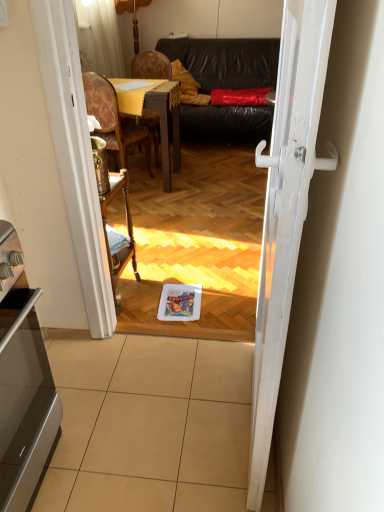
Where is `satin silver oven at lower left`? satin silver oven at lower left is located at coordinates (23, 384).

The height and width of the screenshot is (512, 384). What do you see at coordinates (23, 384) in the screenshot?
I see `satin silver oven at lower left` at bounding box center [23, 384].

This screenshot has height=512, width=384. Find the location of `woodenmaterial/texturetable at upper center`. woodenmaterial/texturetable at upper center is located at coordinates (160, 117).

Describe the element at coordinates (150, 425) in the screenshot. I see `beige tile at lower center` at that location.

Describe the element at coordinates (150, 66) in the screenshot. This screenshot has height=512, width=384. I see `wooden upholstered chair at center, arranged as the 1th chair when viewed from the back` at that location.

At what (x,y) coordinates should I click in order to perform the action: click on leather couch at center. Please return your answer as a coordinate pair (x, y). The image size is (384, 512). Looking at the image, I should click on (226, 61).

I want to click on woodenchair at center, marked as the 2th chair in a back-to-front arrangement, so click(x=113, y=120).

In order to click on satin silver oven at lower left in this screenshot , I will do `click(23, 384)`.

Based on the photo, considering the relative positions of leather couch at center and satin silver oven at lower left in the image provided, is leather couch at center in front of satin silver oven at lower left?

That is False.

This screenshot has width=384, height=512. In order to click on studio couch above the satin silver oven at lower left (from the image's perspective) in this screenshot , I will do `click(226, 61)`.

From a real-world perspective, is leather couch at center over satin silver oven at lower left?

Correct, in the physical world, leather couch at center is higher than satin silver oven at lower left.

This screenshot has width=384, height=512. In order to click on appliance below the woodenmaterial/texturetable at upper center (from a real-world perspective) in this screenshot , I will do `click(23, 384)`.

In the scene shown: How many degrees apart are the facing directions of woodenmaterial/texturetable at upper center and satin silver oven at lower left?

Answer: 91.9 degrees separate the facing orientations of woodenmaterial/texturetable at upper center and satin silver oven at lower left.

Does woodenmaterial/texturetable at upper center have a smaller size compared to satin silver oven at lower left?

Actually, woodenmaterial/texturetable at upper center might be larger than satin silver oven at lower left.

Would you say woodenmaterial/texturetable at upper center is to the left or to the right of satin silver oven at lower left in the picture?

Clearly, woodenmaterial/texturetable at upper center is on the right of satin silver oven at lower left in the image.

This screenshot has width=384, height=512. What are the coordinates of `studio couch on the right of woodenmaterial/texturetable at upper center` in the screenshot? It's located at (226, 61).

Between woodenmaterial/texturetable at upper center and leather couch at center, which one appears on the left side from the viewer's perspective?

From the viewer's perspective, woodenmaterial/texturetable at upper center appears more on the left side.

Consider the image. Which object is further away from the camera, woodenmaterial/texturetable at upper center or leather couch at center?

leather couch at center is more distant.

Who is shorter, woodenmaterial/texturetable at upper center or leather couch at center?

Standing shorter between the two is woodenmaterial/texturetable at upper center.

Which object is positioned more to the right, white glossy door at center or woodenmaterial/texturetable at upper center?

white glossy door at center is more to the right.

Which of these two, white glossy door at center or woodenmaterial/texturetable at upper center, is smaller?

white glossy door at center.

Is white glossy door at center far from woodenmaterial/texturetable at upper center?

Yes.

From a real-world perspective, which object rests below the other?

From a 3D spatial view, wooden upholstered chair at center, arranged as the 2th chair when viewed from the front, is below.

How much distance is there between wooden upholstered chair at center, arranged as the 1th chair when viewed from the back, and woodenchair at center, placed as the 1th chair when sorted from front to back?

The distance of wooden upholstered chair at center, arranged as the 1th chair when viewed from the back, from woodenchair at center, placed as the 1th chair when sorted from front to back, is 80.95 centimeters.

Considering the relative sizes of wooden upholstered chair at center, arranged as the 1th chair when viewed from the back, and woodenchair at center, marked as the 2th chair in a back-to-front arrangement, in the image provided, is wooden upholstered chair at center, arranged as the 1th chair when viewed from the back, smaller than woodenchair at center, marked as the 2th chair in a back-to-front arrangement,?

No, wooden upholstered chair at center, arranged as the 1th chair when viewed from the back, is not smaller than woodenchair at center, marked as the 2th chair in a back-to-front arrangement.

Is wooden upholstered chair at center, arranged as the 1th chair when viewed from the back, wider than woodenchair at center, placed as the 1th chair when sorted from front to back?

No.

Could you tell me if woodenchair at center, placed as the 1th chair when sorted from front to back, is facing leather couch at center?

Yes, woodenchair at center, placed as the 1th chair when sorted from front to back, is facing leather couch at center.

Are woodenchair at center, marked as the 2th chair in a back-to-front arrangement, and leather couch at center located far from each other?

woodenchair at center, marked as the 2th chair in a back-to-front arrangement, is far away from leather couch at center.

Is woodenchair at center, marked as the 2th chair in a back-to-front arrangement, to the right of leather couch at center from the viewer's perspective?

In fact, woodenchair at center, marked as the 2th chair in a back-to-front arrangement, is to the left of leather couch at center.

In the image, is woodenchair at center, placed as the 1th chair when sorted from front to back, positioned in front of or behind leather couch at center?

woodenchair at center, placed as the 1th chair when sorted from front to back, is positioned closer to the viewer than leather couch at center.

Considering the positions of points (137, 67) and (301, 135), is point (137, 67) farther from camera compared to point (301, 135)?

That is True.

From a real-world perspective, which object stands above the other?

From a 3D spatial view, white glossy door at center is above.

Would you say wooden upholstered chair at center, arranged as the 2th chair when viewed from the front, is outside white glossy door at center?

→ Yes.

At what (x,y) coordinates should I click in order to perform the action: click on appliance that appears below the leather couch at center (from the image's perspective). Please return your answer as a coordinate pair (x, y). This screenshot has height=512, width=384. Looking at the image, I should click on (23, 384).

Where is `table above the satin silver oven at lower left (from the image's perspective)`? table above the satin silver oven at lower left (from the image's perspective) is located at coordinates (160, 117).

Based on their spatial positions, is woodenmaterial/texturetable at upper center or wooden upholstered chair at center, arranged as the 1th chair when viewed from the back, further from leather couch at center?

woodenmaterial/texturetable at upper center.

Looking at the image, which one is located further to leather couch at center, satin silver oven at lower left or woodenmaterial/texturetable at upper center?

Among the two, satin silver oven at lower left is located further to leather couch at center.

Based on their spatial positions, is leather couch at center or white glossy door at center further from woodenmaterial/texturetable at upper center?

white glossy door at center is further to woodenmaterial/texturetable at upper center.

Based on their spatial positions, is wooden upholstered chair at center, arranged as the 1th chair when viewed from the back, or beige tile at lower center closer to satin silver oven at lower left?

beige tile at lower center is closer to satin silver oven at lower left.

From the image, which object appears to be farther from beige tile at lower center, woodenchair at center, placed as the 1th chair when sorted from front to back, or white glossy door at center?

Based on the image, woodenchair at center, placed as the 1th chair when sorted from front to back, appears to be further to beige tile at lower center.

From the image, which object appears to be nearer to leather couch at center, beige tile at lower center or woodenchair at center, placed as the 1th chair when sorted from front to back?

woodenchair at center, placed as the 1th chair when sorted from front to back, lies closer to leather couch at center than the other object.

From the image, which object appears to be nearer to white glossy door at center, wooden upholstered chair at center, arranged as the 2th chair when viewed from the front, or woodenchair at center, marked as the 2th chair in a back-to-front arrangement?

woodenchair at center, marked as the 2th chair in a back-to-front arrangement, is positioned closer to the anchor white glossy door at center.

Based on their spatial positions, is leather couch at center or woodenchair at center, placed as the 1th chair when sorted from front to back, closer to beige tile at lower center?

woodenchair at center, placed as the 1th chair when sorted from front to back, is positioned closer to the anchor beige tile at lower center.

Where is `chair between white glossy door at center and woodenmaterial/texturetable at upper center in the front-back direction`? chair between white glossy door at center and woodenmaterial/texturetable at upper center in the front-back direction is located at coordinates click(113, 120).

Image resolution: width=384 pixels, height=512 pixels. I want to click on tile between white glossy door at center and woodenmaterial/texturetable at upper center from front to back, so click(150, 425).

Image resolution: width=384 pixels, height=512 pixels. Identify the location of tile between satin silver oven at lower left and white glossy door at center in the horizontal direction. (150, 425).

The height and width of the screenshot is (512, 384). What are the coordinates of `table between beige tile at lower center and leather couch at center from front to back` in the screenshot? It's located at (160, 117).